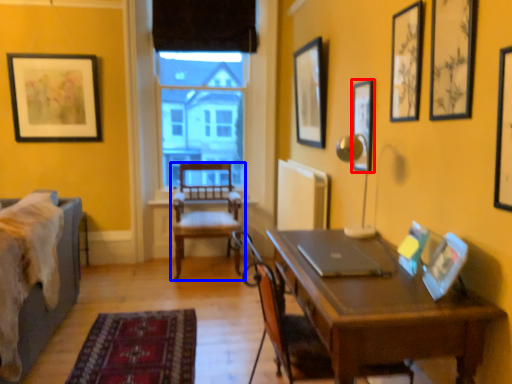
Question: Which object is further to the camera taking this photo, picture frame (highlighted by a red box) or chair (highlighted by a blue box)?

Choices:
 (A) picture frame
 (B) chair

Answer: (B)